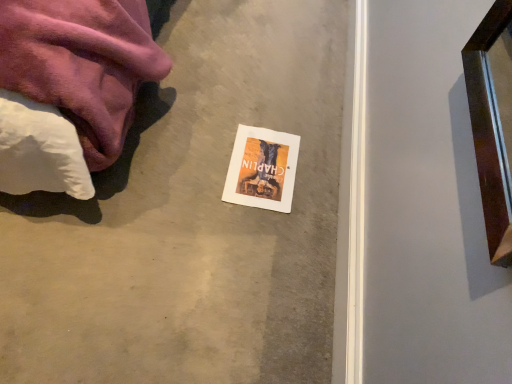
Locate an element on the screen. This screenshot has height=384, width=512. empty space that is ontop of smooth concrete at center (from a real-world perspective) is located at coordinates (215, 190).